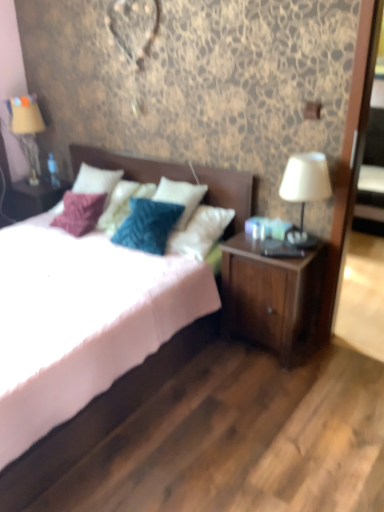
Question: Is white fabric lampshade at right, which is the first table lamp from front to back, positioned before matte beige fabric at left, the 1th table lamp positioned from the left?

Choices:
 (A) no
 (B) yes

Answer: (B)

Question: From the image's perspective, is white fabric lampshade at right, the 1th table lamp positioned from the right, under matte beige fabric at left, the 2th table lamp from the right?

Choices:
 (A) yes
 (B) no

Answer: (A)

Question: Is white fabric lampshade at right, the 2th table lamp from the left, at the right side of matte beige fabric at left, which is the first table lamp from top to bottom?

Choices:
 (A) yes
 (B) no

Answer: (A)

Question: Can you confirm if white fabric lampshade at right, the 1th table lamp positioned from the right, is thinner than matte beige fabric at left, marked as the 1th table lamp in a back-to-front arrangement?

Choices:
 (A) yes
 (B) no

Answer: (A)

Question: Is white fabric lampshade at right, which is counted as the second table lamp, starting from the back, directly adjacent to matte beige fabric at left, which is counted as the 2th table lamp, starting from the front?

Choices:
 (A) no
 (B) yes

Answer: (A)

Question: Is white fabric lampshade at right, arranged as the second table lamp when viewed from the top, positioned with its back to matte beige fabric at left, which is counted as the 2th table lamp, starting from the front?

Choices:
 (A) yes
 (B) no

Answer: (B)

Question: From the image's perspective, is white fabric lampshade at right, arranged as the second table lamp when viewed from the top, above white matte bed at center?

Choices:
 (A) no
 (B) yes

Answer: (B)

Question: Can you confirm if white fabric lampshade at right, the 1th table lamp ordered from the bottom, is positioned to the right of white matte bed at center?

Choices:
 (A) no
 (B) yes

Answer: (B)

Question: Would you say white fabric lampshade at right, the 1th table lamp positioned from the right, is outside white matte bed at center?

Choices:
 (A) yes
 (B) no

Answer: (A)

Question: Can you confirm if white fabric lampshade at right, which is the first table lamp from front to back, is positioned to the left of white matte bed at center?

Choices:
 (A) yes
 (B) no

Answer: (B)

Question: Is white fabric lampshade at right, the 2th table lamp from the left, wider than white matte bed at center?

Choices:
 (A) no
 (B) yes

Answer: (A)

Question: Can you confirm if white fabric lampshade at right, which is counted as the second table lamp, starting from the back, is shorter than white matte bed at center?

Choices:
 (A) yes
 (B) no

Answer: (A)

Question: Is white matte bed at center outside white fabric lampshade at right, arranged as the second table lamp when viewed from the top?

Choices:
 (A) yes
 (B) no

Answer: (A)